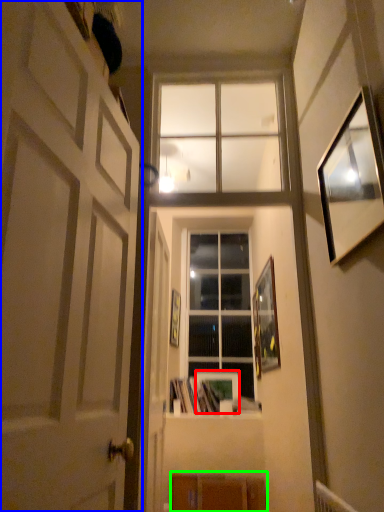
Question: Based on their relative distances, which object is farther from picture frame (highlighted by a red box)? Choose from door (highlighted by a blue box) and shelf (highlighted by a green box).

Choices:
 (A) door
 (B) shelf

Answer: (A)